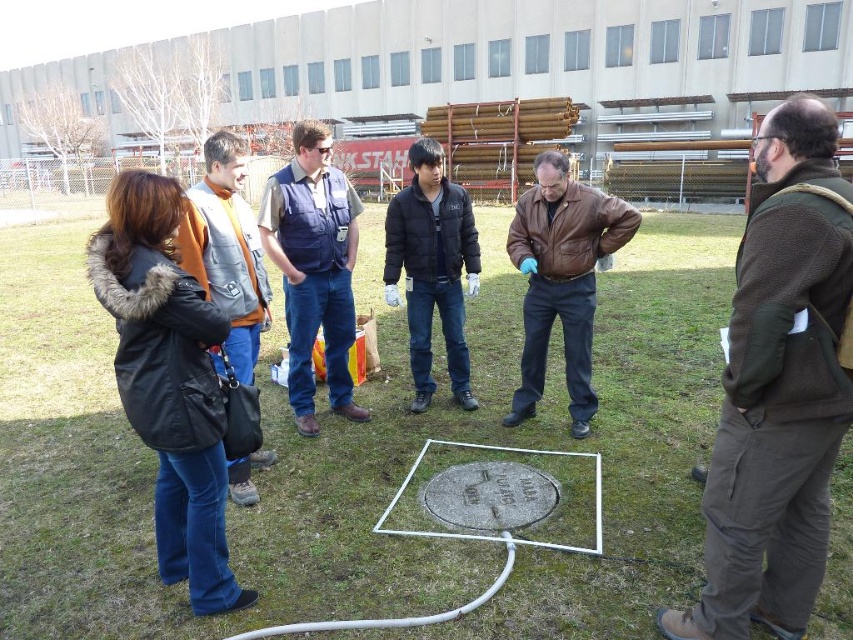
Question: Is black fuzzy coat at left thinner than blue denim jeans at center?

Choices:
 (A) yes
 (B) no

Answer: (B)

Question: Can you confirm if brown leather jacket at center is positioned above black matte jacket at center?

Choices:
 (A) no
 (B) yes

Answer: (A)

Question: Does brown fuzzy jacket at center appear on the left side of brown leather jacket at center?

Choices:
 (A) no
 (B) yes

Answer: (A)

Question: Which object is positioned farthest from the orange fleece vest at left?

Choices:
 (A) blue denim jeans at center
 (B) brown leather jacket at center
 (C) brown fuzzy jacket at center
 (D) black fuzzy coat at left

Answer: (C)

Question: Which object appears closest to the camera in this image?

Choices:
 (A) orange fleece vest at left
 (B) blue denim jeans at center

Answer: (A)

Question: Which is nearer to the blue denim jeans at center?

Choices:
 (A) orange fleece vest at left
 (B) brown fuzzy jacket at center
 (C) brown leather jacket at center

Answer: (A)